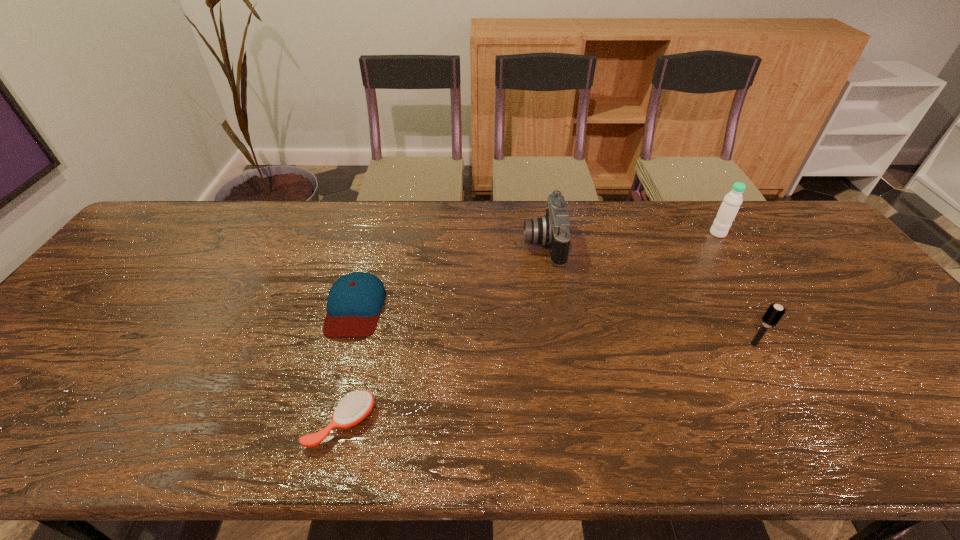
What are the coordinates of `vacant space that is in between the second shortest object and the camera` in the screenshot? It's located at (449, 275).

The height and width of the screenshot is (540, 960). In order to click on free space between the fourth tallest object and the shortest object in this screenshot , I will do `click(348, 365)`.

Where is `empty location between the baseball cap and the camera`? empty location between the baseball cap and the camera is located at coordinates (449, 275).

You are a GUI agent. You are given a task and a screenshot of the screen. Output one action in this format:
    pyautogui.click(x=<x>, y=<y>)
    Task: Click on the unoccupied area between the nearer hairbrush and the second shortest object
    
    Given the screenshot: What is the action you would take?
    pyautogui.click(x=348, y=365)

Locate an element on the screen. This screenshot has height=540, width=960. object that is the second nearest to the fourth object from left to right is located at coordinates (553, 230).

This screenshot has width=960, height=540. I want to click on object identified as the second closest to the baseball cap, so click(x=553, y=230).

Where is `free space in the image that satisfies the following two spatial constraints: 1. on the front-facing side of the farther hairbrush; 2. on the left side of the third object from left to right`? This screenshot has width=960, height=540. free space in the image that satisfies the following two spatial constraints: 1. on the front-facing side of the farther hairbrush; 2. on the left side of the third object from left to right is located at coordinates (559, 345).

Where is `free space that satisfies the following two spatial constraints: 1. on the front-facing side of the second object from right to left; 2. on the left side of the camera`? The image size is (960, 540). free space that satisfies the following two spatial constraints: 1. on the front-facing side of the second object from right to left; 2. on the left side of the camera is located at coordinates (559, 345).

The image size is (960, 540). Identify the location of free space that satisfies the following two spatial constraints: 1. on the back side of the nearest object; 2. on the left side of the rightmost object. (387, 233).

The width and height of the screenshot is (960, 540). I want to click on free space that satisfies the following two spatial constraints: 1. on the front-facing side of the third object from right to left; 2. on the left side of the fourth object from left to right, so click(x=559, y=345).